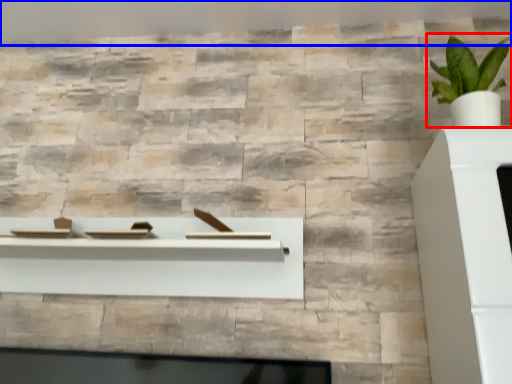
Question: Among these objects, which one is nearest to the camera, houseplant (highlighted by a red box) or backdrop (highlighted by a blue box)?

Choices:
 (A) houseplant
 (B) backdrop

Answer: (A)